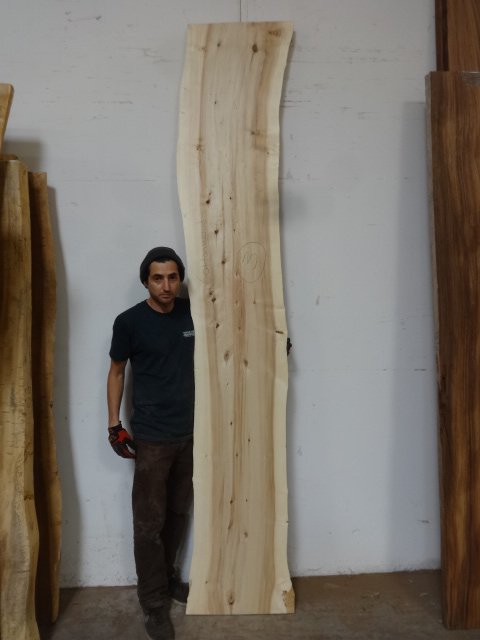
The image size is (480, 640). I want to click on white wall, so pos(355,381).